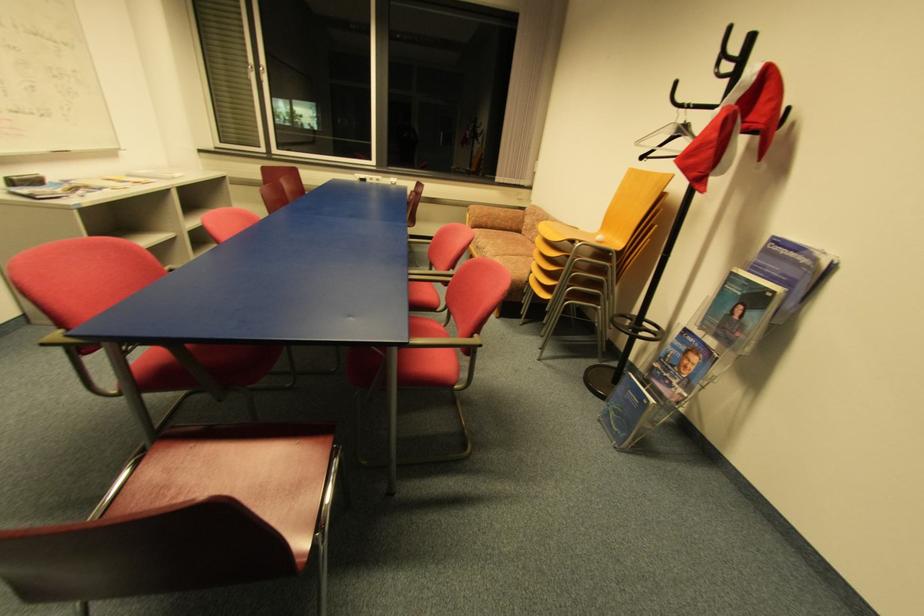
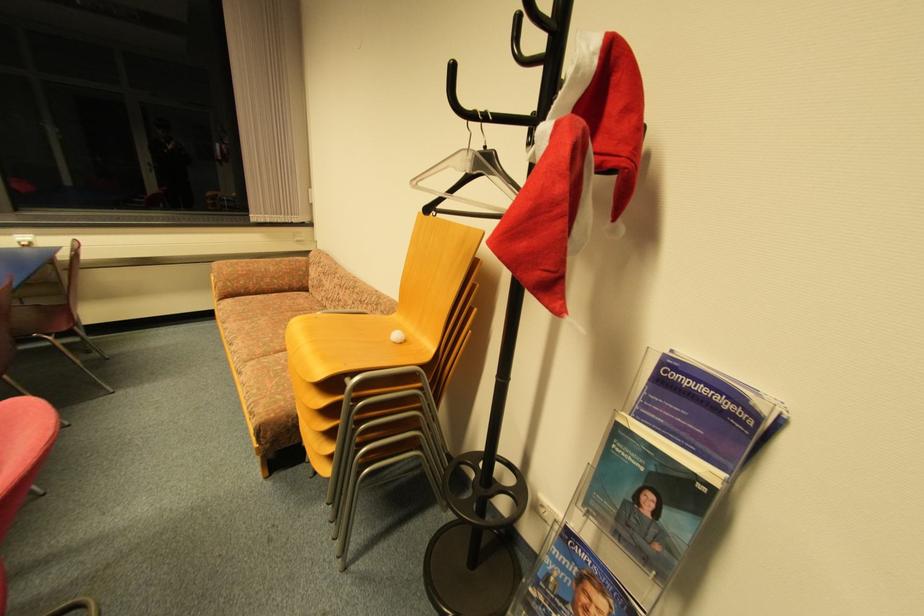
The point at (695, 341) is marked in the first image. Where is the corresponding point in the second image?

(588, 557)